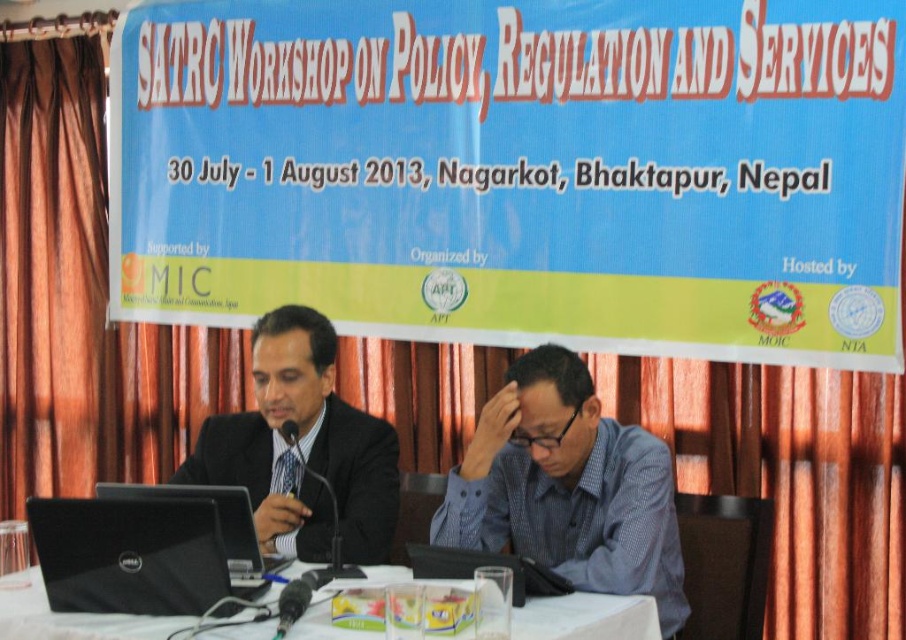
You are an event organizer who needs to place a 1.2 meter tall stand behind the black glossy suit at center and the dell matte black laptop at lower left. Will the stand be taller than both objects?

The black glossy suit at center is taller than dell matte black laptop at lower left. Since the stand is 1.2 meters tall, it will be taller than both objects.

You are a photographer preparing to take a professional portrait of the person wearing the black glossy suit at center. You need to ensure that the dell matte black laptop at lower left does not appear in the photo. What adjustment should you make to your camera position or framing?

Move the camera position forward closer to the black glossy suit at center so that the dell matte black laptop at lower left is out of the frame behind the suit.